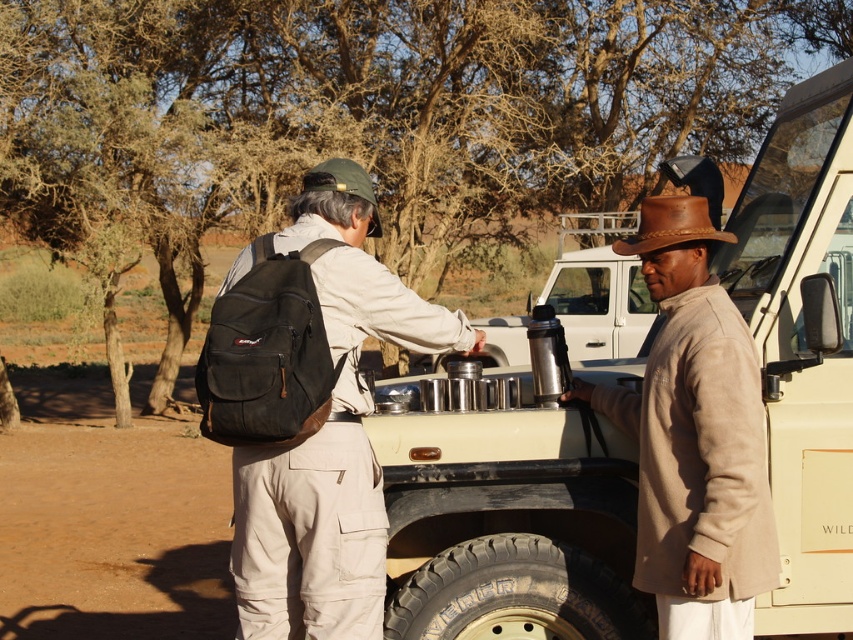
Question: Is matte black backpack at center closer to the viewer compared to brown leather cowboy hat at right?

Choices:
 (A) yes
 (B) no

Answer: (A)

Question: Estimate the real-world distances between objects in this image. Which object is farther from the metallic beige jeep at center?

Choices:
 (A) tan suede hat at right
 (B) matte black backpack at center

Answer: (B)

Question: Which object appears closest to the camera in this image?

Choices:
 (A) tan suede hat at right
 (B) matte black backpack at center
 (C) metallic beige jeep at center
 (D) brown leather cowboy hat at right

Answer: (B)

Question: Which object is the closest to the tan suede hat at right?

Choices:
 (A) brown leather cowboy hat at right
 (B) metallic beige jeep at center

Answer: (B)

Question: Can you confirm if matte black backpack at center is thinner than brown leather cowboy hat at right?

Choices:
 (A) no
 (B) yes

Answer: (A)

Question: Is metallic beige jeep at center positioned before tan suede hat at right?

Choices:
 (A) yes
 (B) no

Answer: (B)